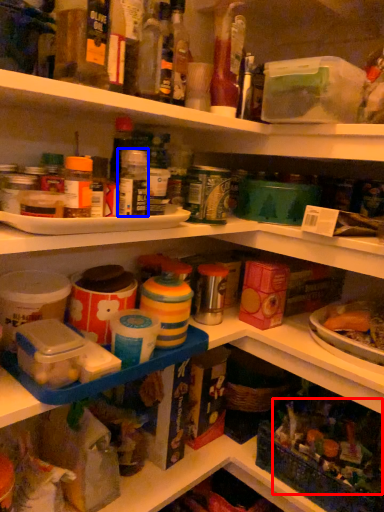
Question: Which object appears closest to the camera in this image, food (highlighted by a red box) or bottle (highlighted by a blue box)?

Choices:
 (A) food
 (B) bottle

Answer: (B)